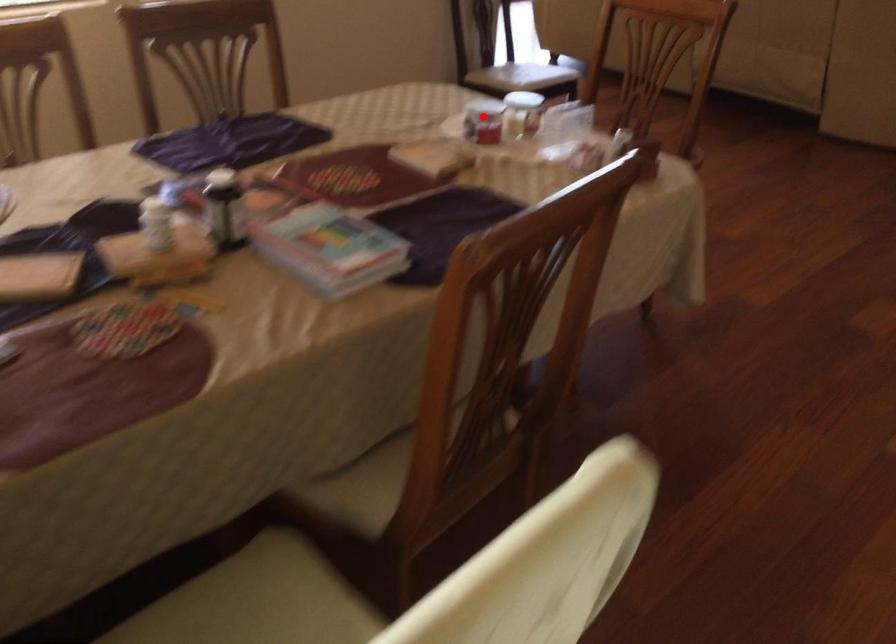
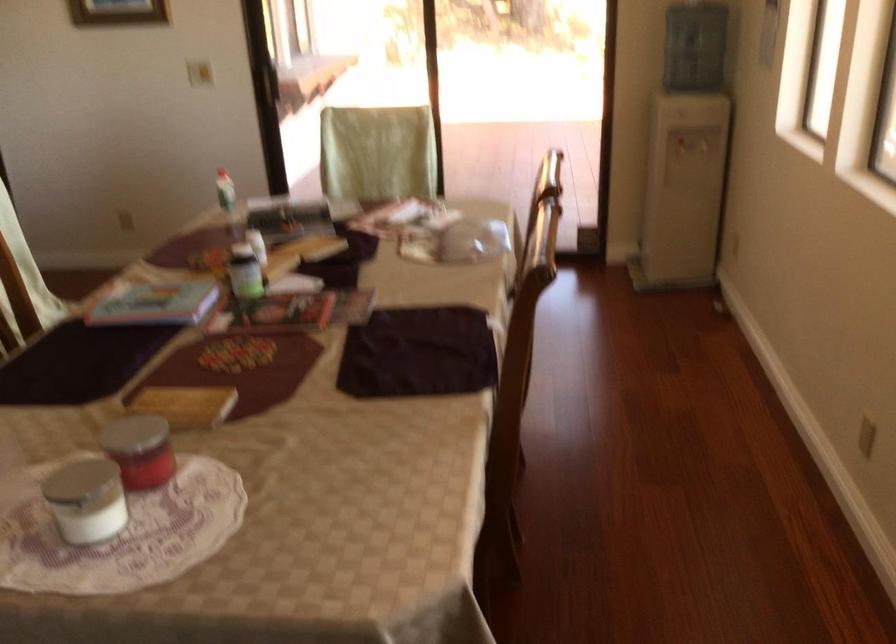
Question: I am providing you with two images of the same scene from different viewpoints. Given a red point in image1, look at the same physical point in image2. Is it:

Choices:
 (A) Closer to the viewpoint
 (B) Farther from the viewpoint

Answer: (A)